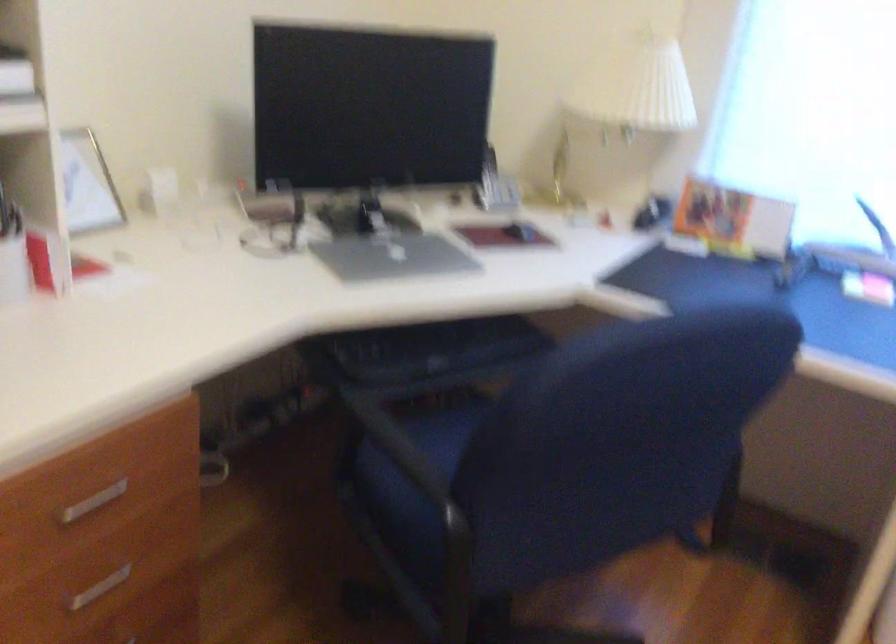
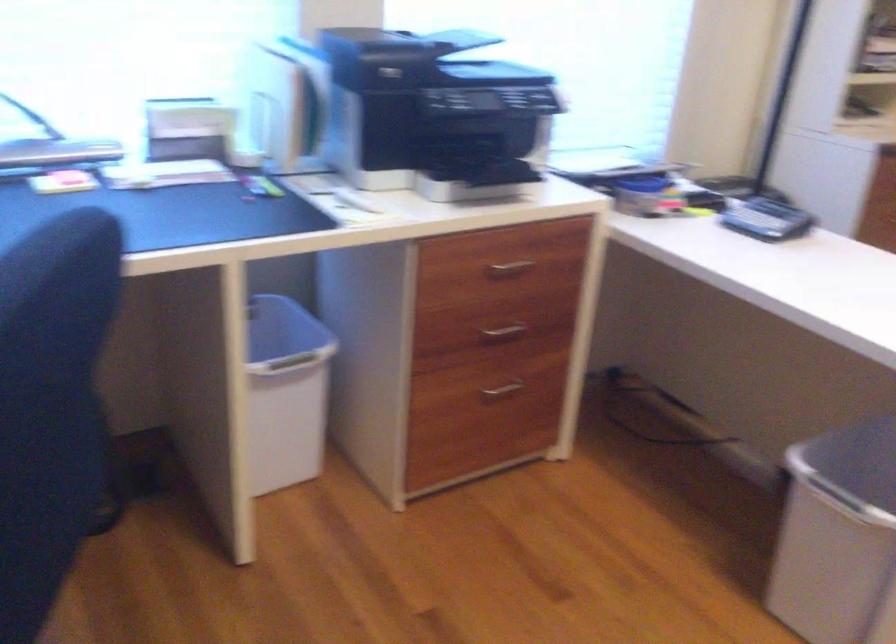
The images are taken continuously from a first-person perspective. In which direction is your viewpoint rotating?

The camera rotated toward right-down.